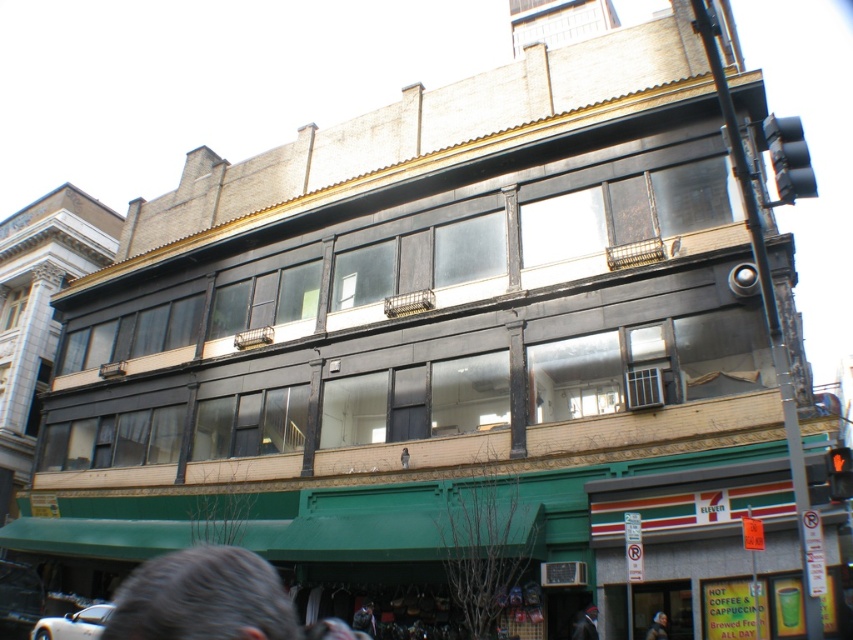
You are a customer entering the building and see the gray matte hair at lower left and the dark brown leather jacket at lower right. Which object is positioned higher from the ground?

The gray matte hair at lower left is positioned higher from the ground than the dark brown leather jacket at lower right because it is above it.

You are a delivery person with a cart that is 2 meters wide. You need to navigate between the smooth black hair at lower center and the dark brown leather jacket at lower right to reach the entrance under the green awning. Can your cart fit through the space between them?

The distance between the smooth black hair at lower center and the dark brown leather jacket at lower right is 3.00 meters. Since your cart is 2 meters wide, it can fit through the space between them.

You are standing in front of the building and want to locate two specific points marked on the facade. The first point is at coordinate point (138,632) and the second is at point (666,637). Which point is closer to you?

Point (138,632) is in front of point (666,637), so the first point is closer to you.